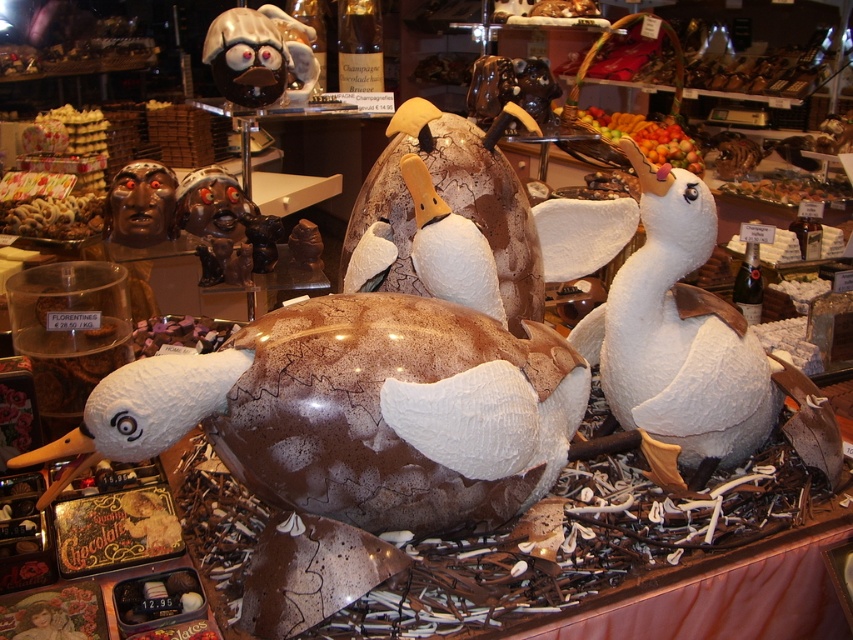
Question: Which object is closer to the camera taking this photo?

Choices:
 (A) shiny chocolate figurine at upper center
 (B) white matte duckling at center

Answer: (B)

Question: Is white matte duckling at center smaller than shiny chocolate figurine at upper center?

Choices:
 (A) yes
 (B) no

Answer: (B)

Question: Which point is closer to the camera?

Choices:
 (A) (224, 29)
 (B) (694, 472)

Answer: (B)

Question: Does white matte duckling at center appear on the right side of shiny chocolate figurine at upper center?

Choices:
 (A) yes
 (B) no

Answer: (A)

Question: Among these points, which one is nearest to the camera?

Choices:
 (A) (666, 186)
 (B) (248, 13)

Answer: (A)

Question: Is white matte duckling at center thinner than shiny chocolate figurine at upper center?

Choices:
 (A) no
 (B) yes

Answer: (A)